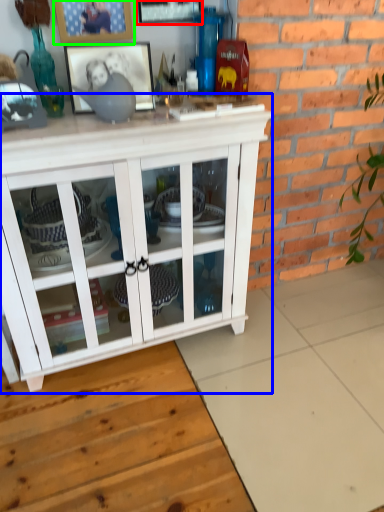
Question: Which object is the closest to the picture frame (highlighted by a red box)? Choose among these: cabinetry (highlighted by a blue box) or picture frame (highlighted by a green box).

Choices:
 (A) cabinetry
 (B) picture frame

Answer: (B)